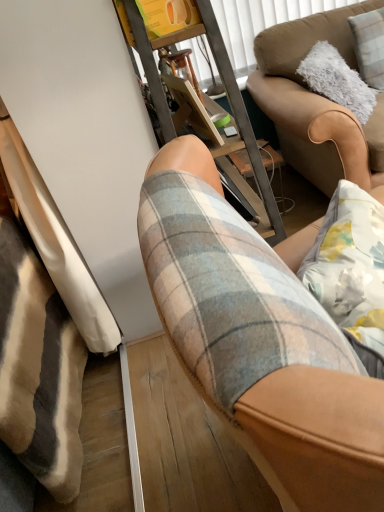
The width and height of the screenshot is (384, 512). I want to click on metal frame at center, so click(x=220, y=77).

Describe the element at coordinates (220, 77) in the screenshot. I see `metal frame at center` at that location.

What is the approximate width of fluffy white pillow at upper right?

It is 7.26 inches.

Locate an element on the screen. metal frame at center is located at coordinates (220, 77).

From the image's perspective, does fluffy white pillow at upper right appear lower than metal frame at center?

Actually, fluffy white pillow at upper right appears above metal frame at center in the image.

At what (x,y) coordinates should I click in order to perform the action: click on furniture located below the fluffy white pillow at upper right (from the image's perspective). Please return your answer as a coordinate pair (x, y). Looking at the image, I should click on (220, 77).

Is fluffy white pillow at upper right located outside metal frame at center?

Absolutely, fluffy white pillow at upper right is external to metal frame at center.

Does fluffy white pillow at upper right turn towards metal frame at center?

No, fluffy white pillow at upper right is not turned towards metal frame at center.

Considering the relative positions of metal frame at center and brown leather couch at upper right in the image provided, is metal frame at center to the left or to the right of brown leather couch at upper right?

Based on their positions, metal frame at center is located to the left of brown leather couch at upper right.

From the image's perspective, is metal frame at center below brown leather couch at upper right?

Yes.

From the picture: Is metal frame at center smaller than brown leather couch at upper right?

Yes.

Consider the image. Is metal frame at center positioned far away from brown leather couch at upper right?

metal frame at center is actually quite close to brown leather couch at upper right.

From the image's perspective, does brown leather couch at upper right appear higher than fluffy white pillow at upper right?

Incorrect, from the image's perspective, brown leather couch at upper right is lower than fluffy white pillow at upper right.

Is point (329, 105) closer or farther from the camera than point (383, 37)?

Point (329, 105) appears to be closer to the viewer than point (383, 37).

Does brown leather couch at upper right appear on the right side of fluffy white pillow at upper right?

No.

From the image's perspective, which one is positioned higher, fluffy white pillow at upper right or plaid fabric shorts at center?

fluffy white pillow at upper right, from the image's perspective.

Can you confirm if fluffy white pillow at upper right is shorter than plaid fabric shorts at center?

Correct, fluffy white pillow at upper right is not as tall as plaid fabric shorts at center.

The image size is (384, 512). In order to click on chair below the fluffy white pillow at upper right (from the image's perspective) in this screenshot , I will do `click(259, 341)`.

Is fluffy white pillow at upper right bigger or smaller than plaid fabric shorts at center?

Considering their sizes, fluffy white pillow at upper right takes up less space than plaid fabric shorts at center.

Is plaid fabric shorts at center completely or partially outside of brown leather couch at upper right?

Absolutely, plaid fabric shorts at center is external to brown leather couch at upper right.

Considering the sizes of plaid fabric shorts at center and brown leather couch at upper right in the image, is plaid fabric shorts at center taller or shorter than brown leather couch at upper right?

plaid fabric shorts at center is taller than brown leather couch at upper right.

From the image's perspective, would you say plaid fabric shorts at center is positioned over brown leather couch at upper right?

Actually, plaid fabric shorts at center appears below brown leather couch at upper right in the image.

From a real-world perspective, relative to brown leather couch at upper right, is plaid fabric shorts at center vertically above or below?

From a real-world perspective, plaid fabric shorts at center is physically above brown leather couch at upper right.

How different are the orientations of brown leather couch at upper right and plaid fabric shorts at center in degrees?

88.9 degrees separate the facing orientations of brown leather couch at upper right and plaid fabric shorts at center.

Between brown leather couch at upper right and plaid fabric shorts at center, which one is positioned behind?

brown leather couch at upper right is behind.

Could you tell me if brown leather couch at upper right is facing plaid fabric shorts at center?

Yes, brown leather couch at upper right faces towards plaid fabric shorts at center.

Based on their positions, is fluffy white pillow at upper right located to the left or right of brown leather couch at upper right?

From the image, it's evident that fluffy white pillow at upper right is to the right of brown leather couch at upper right.

How many degrees apart are the facing directions of fluffy white pillow at upper right and brown leather couch at upper right?

The angle between the facing direction of fluffy white pillow at upper right and the facing direction of brown leather couch at upper right is 13.4 degrees.

Is point (382, 46) in front of point (302, 85)?

Yes.

Looking at this image, does fluffy white pillow at upper right come behind brown leather couch at upper right?

That is True.

Find the location of a particular element. This screenshot has height=512, width=384. furniture in front of the fluffy white pillow at upper right is located at coordinates (220, 77).

The width and height of the screenshot is (384, 512). What are the coordinates of `studio couch below the metal frame at center (from a real-world perspective)` in the screenshot? It's located at (317, 103).

When comparing their distances from metal frame at center, does brown leather couch at upper right or plaid fabric shorts at center seem closer?

The object closer to metal frame at center is brown leather couch at upper right.

When comparing their distances from metal frame at center, does plaid fabric shorts at center or brown leather couch at upper right seem further?

plaid fabric shorts at center is positioned further to the anchor metal frame at center.

Looking at the image, which one is located closer to fluffy white pillow at upper right, metal frame at center or brown leather couch at upper right?

brown leather couch at upper right is positioned closer to the anchor fluffy white pillow at upper right.

Looking at the image, which one is located closer to fluffy white pillow at upper right, brown leather couch at upper right or plaid fabric shorts at center?

brown leather couch at upper right is closer to fluffy white pillow at upper right.

Which object lies nearer to the anchor point plaid fabric shorts at center, metal frame at center or brown leather couch at upper right?

The object closer to plaid fabric shorts at center is metal frame at center.

Which object lies further to the anchor point metal frame at center, brown leather couch at upper right or fluffy white pillow at upper right?

fluffy white pillow at upper right is positioned further to the anchor metal frame at center.

Based on the photo, estimate the real-world distances between objects in this image. Which object is closer to metal frame at center, fluffy white pillow at upper right or plaid fabric shorts at center?

Based on the image, plaid fabric shorts at center appears to be nearer to metal frame at center.

Which object lies further to the anchor point fluffy white pillow at upper right, brown leather couch at upper right or metal frame at center?

metal frame at center.

Find the location of a particular element. studio couch between metal frame at center and fluffy white pillow at upper right in the horizontal direction is located at coordinates (317, 103).

Identify the location of furniture between plaid fabric shorts at center and fluffy white pillow at upper right along the z-axis. (220, 77).

The image size is (384, 512). I want to click on furniture positioned between plaid fabric shorts at center and brown leather couch at upper right from near to far, so click(220, 77).

The height and width of the screenshot is (512, 384). I want to click on studio couch between plaid fabric shorts at center and fluffy white pillow at upper right along the z-axis, so click(317, 103).